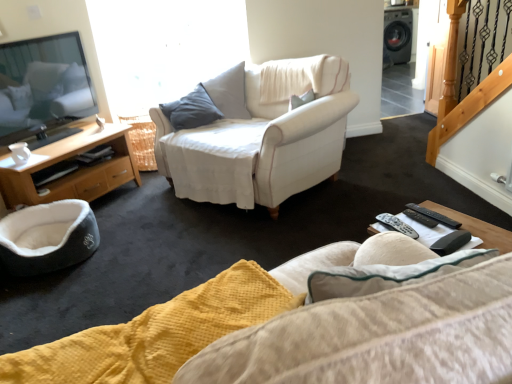
Identify the location of free space between black plastic remote at lower right, the 2th remote viewed from the right, and black plastic remote at lower right, the 1th remote when ordered from left to right. The image size is (512, 384). (407, 223).